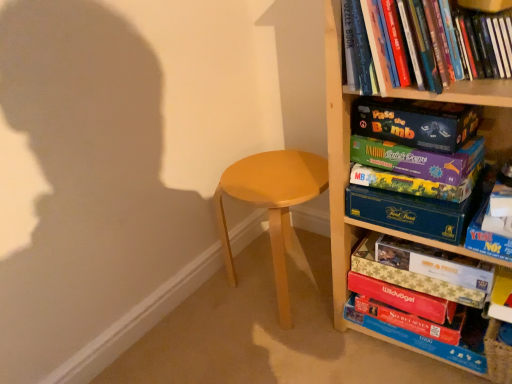
Question: From a real-world perspective, is wooden bookcase at right under hardcover book at upper right, which appears as the second book when ordered from the bottom?

Choices:
 (A) no
 (B) yes

Answer: (B)

Question: Does wooden bookcase at right appear on the right side of hardcover book at upper right, the second book in the top-to-bottom sequence?

Choices:
 (A) yes
 (B) no

Answer: (B)

Question: Considering the relative sizes of wooden bookcase at right and hardcover book at upper right, which appears as the second book when ordered from the bottom, in the image provided, is wooden bookcase at right taller than hardcover book at upper right, which appears as the second book when ordered from the bottom,?

Choices:
 (A) yes
 (B) no

Answer: (A)

Question: Could you tell me if wooden bookcase at right is turned towards hardcover book at upper right, the second book in the top-to-bottom sequence?

Choices:
 (A) yes
 (B) no

Answer: (A)

Question: Can you confirm if wooden bookcase at right is bigger than hardcover book at upper right, which appears as the second book when ordered from the bottom?

Choices:
 (A) no
 (B) yes

Answer: (B)

Question: Considering the relative sizes of wooden bookcase at right and hardcover book at upper right, which appears as the second book when ordered from the bottom, in the image provided, is wooden bookcase at right thinner than hardcover book at upper right, which appears as the second book when ordered from the bottom,?

Choices:
 (A) no
 (B) yes

Answer: (A)

Question: Can you confirm if light brown wood stool at center is wider than red matte board game at lower right, acting as the first paperback book starting from the bottom?

Choices:
 (A) yes
 (B) no

Answer: (A)

Question: From the image's perspective, is light brown wood stool at center above red matte board game at lower right, acting as the 7th paperback book starting from the top?

Choices:
 (A) yes
 (B) no

Answer: (A)

Question: Is light brown wood stool at center positioned with its back to red matte board game at lower right, acting as the 7th paperback book starting from the top?

Choices:
 (A) no
 (B) yes

Answer: (A)

Question: Is light brown wood stool at center at the right side of red matte board game at lower right, acting as the 7th paperback book starting from the top?

Choices:
 (A) yes
 (B) no

Answer: (B)

Question: Is light brown wood stool at center shorter than red matte board game at lower right, acting as the 7th paperback book starting from the top?

Choices:
 (A) yes
 (B) no

Answer: (B)

Question: Is light brown wood stool at center taller than red matte board game at lower right, acting as the first paperback book starting from the bottom?

Choices:
 (A) no
 (B) yes

Answer: (B)

Question: Is gold foil puzzle box at lower right, the fifth paperback book in the top-to-bottom sequence, inside red matte board game at lower right, acting as the 7th paperback book starting from the top?

Choices:
 (A) yes
 (B) no

Answer: (B)